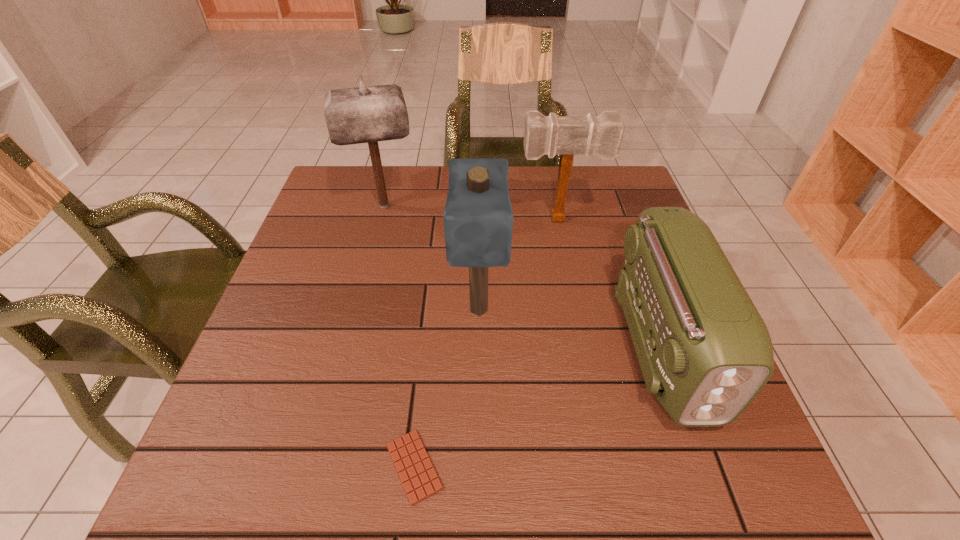
Where is `free point between the nearest mallet and the leftmost mallet`? The image size is (960, 540). free point between the nearest mallet and the leftmost mallet is located at coordinates (431, 258).

Where is `free area in between the shortest object and the leftmost object`? This screenshot has width=960, height=540. free area in between the shortest object and the leftmost object is located at coordinates tap(399, 336).

Locate which object ranks second in proximity to the second shortest object. Please provide its 2D coordinates. Your answer should be formatted as a tuple, i.e. [(x, y)], where the tuple contains the x and y coordinates of a point satisfying the conditions above.

[(478, 219)]

Identify which object is the third closest to the second mallet from right to left. Please provide its 2D coordinates. Your answer should be formatted as a tuple, i.e. [(x, y)], where the tuple contains the x and y coordinates of a point satisfying the conditions above.

[(705, 352)]

Find the location of a particular element. The width and height of the screenshot is (960, 540). mallet that is the nearest to the fourth tallest object is located at coordinates (601, 135).

Locate which mallet is the third closest to the radio_receiver. Please provide its 2D coordinates. Your answer should be formatted as a tuple, i.e. [(x, y)], where the tuple contains the x and y coordinates of a point satisfying the conditions above.

[(363, 114)]